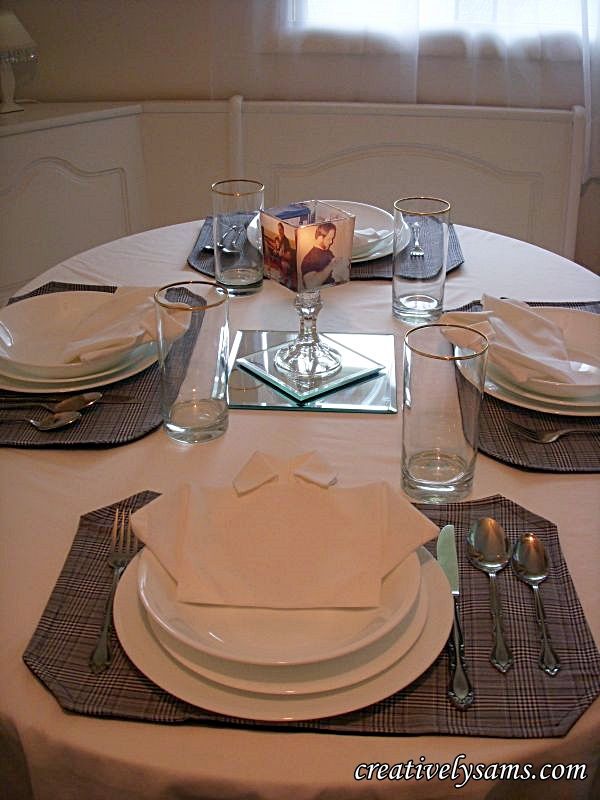
At what (x,y) coordinates should I click in order to perform the action: click on water glasses. Please return your answer as a coordinate pair (x, y). Image resolution: width=600 pixels, height=800 pixels. Looking at the image, I should click on (446, 404), (418, 253), (186, 362), (235, 222).